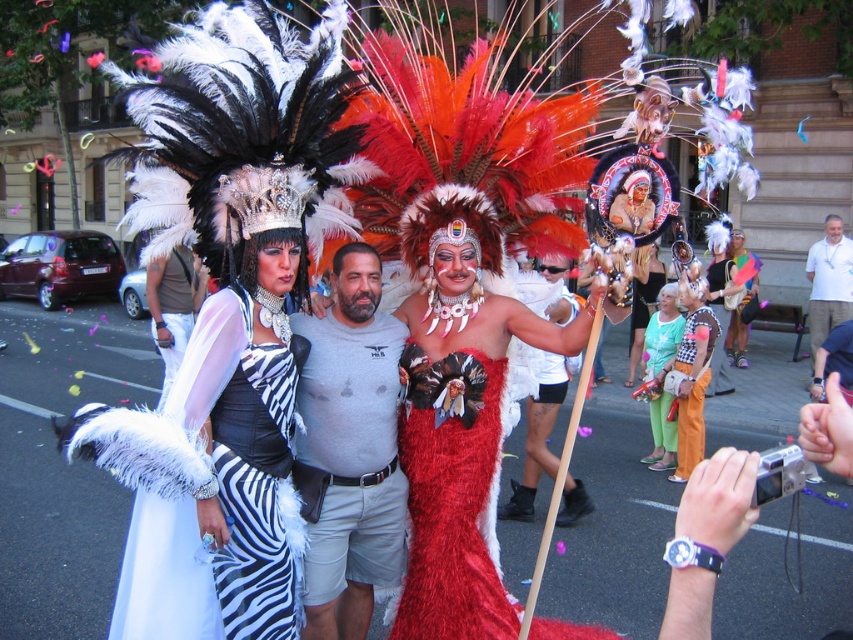
You are a photographer standing at the camera position. You want to take a photo of the zebra print fabric dress at left. Is the dress within your camera lens range? The camera can capture objects up to 10 feet away.

The zebra print fabric dress at left is 8.76 feet away from the camera, which is within the camera lens range of 10 feet. Therefore, the dress can be captured in the photo.

You are a photographer trying to capture both the gray cotton shirt at center and the fuzzy red dress at center in a single frame. Since you want to highlight the height difference between them, which object should you position closer to the camera to emphasize their size difference?

To emphasize the height difference between the gray cotton shirt at center and the fuzzy red dress at center, position the gray cotton shirt at center closer to the camera since it has a greater height compared to the fuzzy red dress at center. This will make the gray cotton shirt at center appear even larger in the frame relative to the fuzzy red dress at center.

You are standing in the middle of the street during the parade. You see a gray cotton shirt at center. Can you reach out and touch it without moving your feet?

The gray cotton shirt at center is 3.30 meters away from the viewer, so you cannot reach it without moving your feet since the average human arm span is about 1.5 meters.